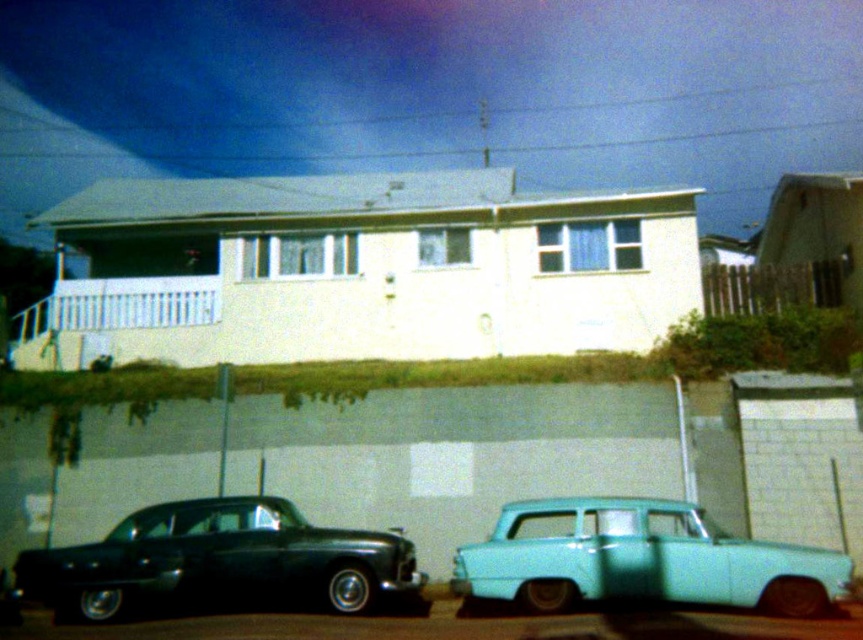
You are a delivery person trying to park your van between the shiny black sedan at lower left and the light blue matte car at lower right. Considering the space between them, can you fit your van which is 2 meters wide?

The space between the shiny black sedan at lower left and the light blue matte car at lower right is not specified in the provided information. Therefore, it is impossible to determine if the van can fit based on the given details.

You are a delivery person approaching the house and need to park your van between the shiny black sedan at lower left and the light blue matte car at lower right. Can you fit your van between them if the van is 2 meters wide?

The shiny black sedan at lower left is further to the viewer than the light blue matte car at lower right, so the distance between them may vary. However, without specific measurements of the space between them, it is impossible to determine if the van can fit. Please check the actual distance on site.

You are a delivery person trying to park your van between the shiny black sedan at lower left and the light blue matte car at lower right. Can you fit your van, which is 2 meters wide, in the space between them?

The shiny black sedan at lower left is to the left of light blue matte car at lower right, but the distance between them isn not specified. Without knowing the exact width of the space, it is impossible to determine if the van can fit.